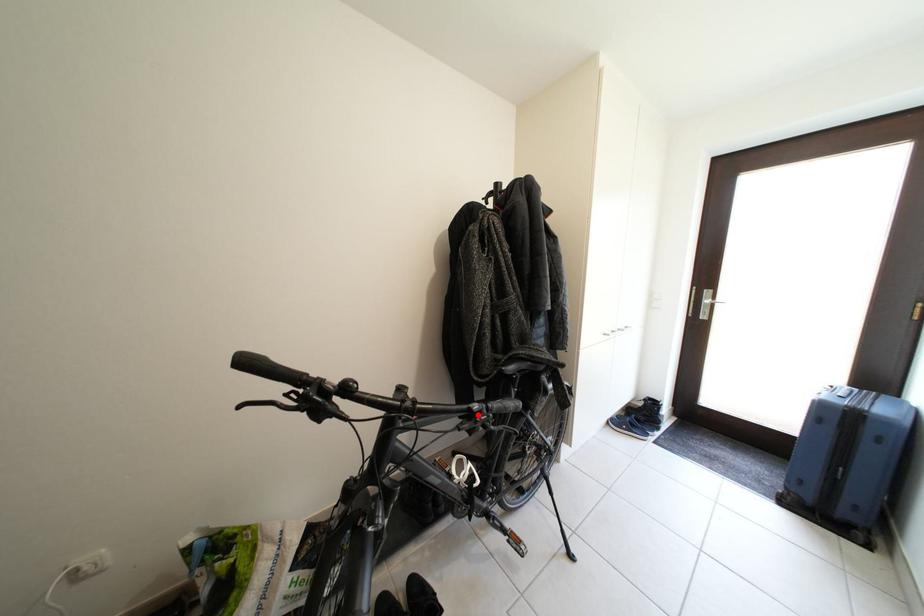
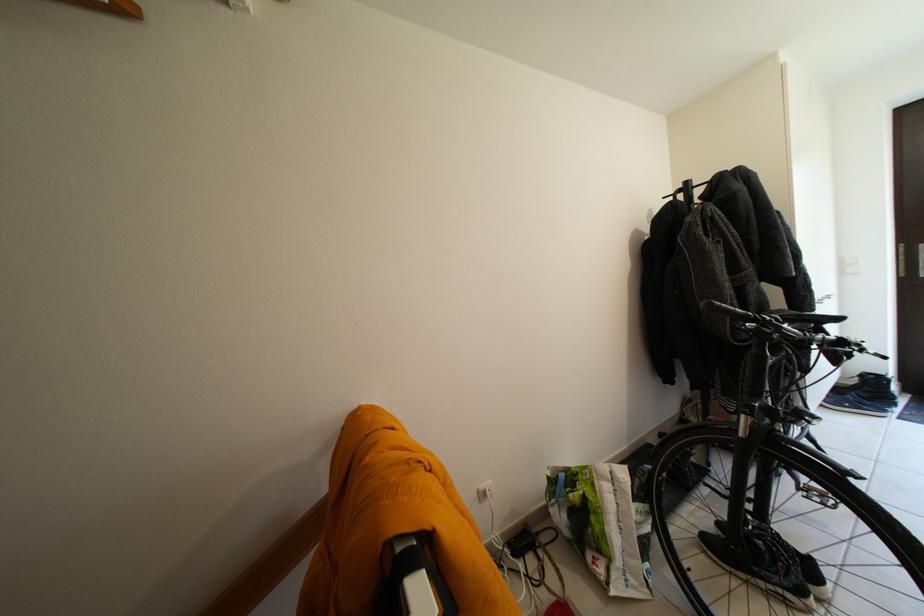
Question: I am providing you with two images of the same scene from different viewpoints. A red point is shown in image1. For the corresponding object point in image2, is it positioned nearer or farther from the camera?

Choices:
 (A) Nearer
 (B) Farther

Answer: (A)